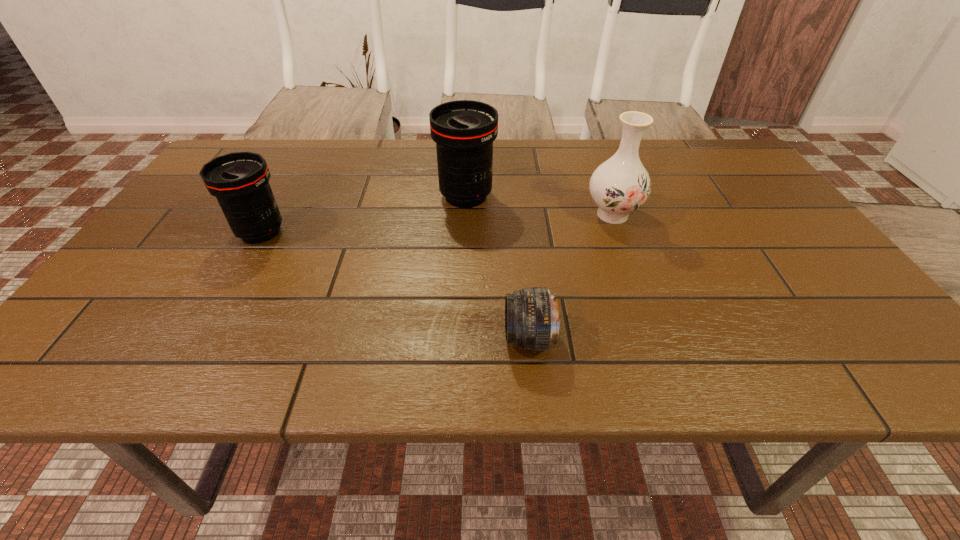
Find the location of a particular element. vase is located at coordinates (620, 185).

I want to click on the farthest telephoto lens, so click(x=464, y=130).

In order to click on the tallest telephoto lens in this screenshot , I will do `click(464, 130)`.

This screenshot has width=960, height=540. In order to click on the leftmost object in this screenshot , I will do click(x=240, y=181).

This screenshot has height=540, width=960. Identify the location of the second shortest telephoto lens. (240, 181).

This screenshot has width=960, height=540. Find the location of `the shortest object`. the shortest object is located at coordinates (532, 322).

Where is `the rightmost telephoto lens`? the rightmost telephoto lens is located at coordinates (532, 322).

Identify the location of free space located on the front of the rightmost object. The height and width of the screenshot is (540, 960). (644, 300).

Where is `free space located on the front of the third object from right to left`? Image resolution: width=960 pixels, height=540 pixels. free space located on the front of the third object from right to left is located at coordinates (462, 295).

I want to click on free space located 0.150m on the left of the second shortest object, so click(173, 232).